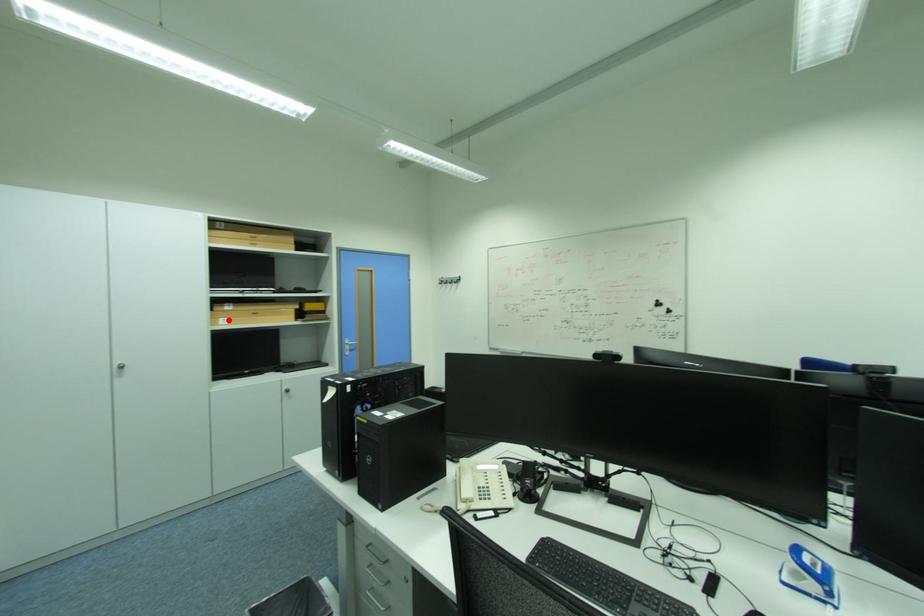
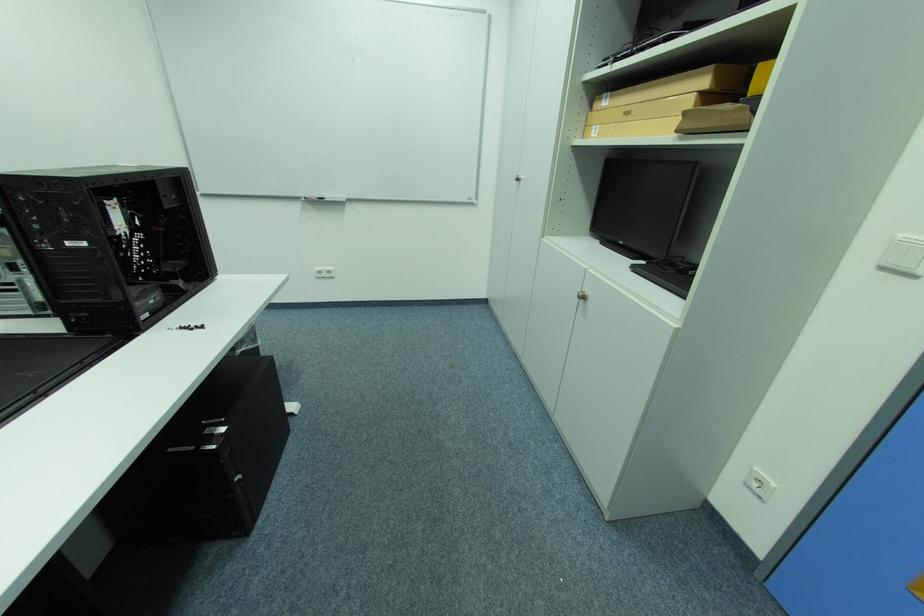
In the second image, find the point that corresponds to the highlighted location in the first image.

(602, 128)